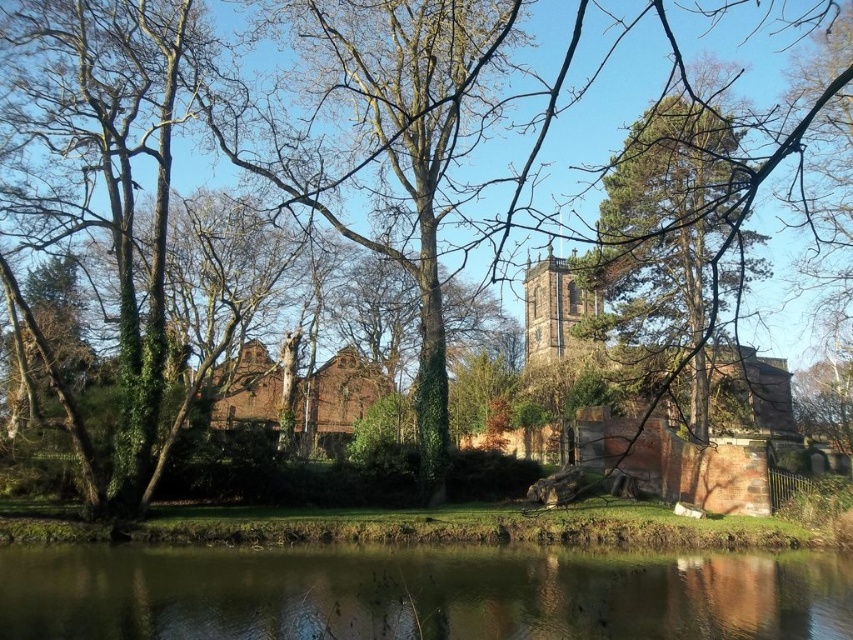
Question: Which object is farther from the camera taking this photo?

Choices:
 (A) green leafy tree at center
 (B) green reflective water at bottom
 (C) brown brick church at center

Answer: (C)

Question: Which point is closer to the camera?

Choices:
 (A) (653, 273)
 (B) (94, 552)

Answer: (B)

Question: Which object appears farthest from the camera in this image?

Choices:
 (A) green reflective water at bottom
 (B) green leafy tree at center
 (C) brown brick church at center

Answer: (C)

Question: Is green reflective water at bottom closer to the viewer compared to green leafy tree at center?

Choices:
 (A) yes
 (B) no

Answer: (B)

Question: Can you confirm if green leafy tree at center is thinner than brown brick church at center?

Choices:
 (A) yes
 (B) no

Answer: (B)

Question: Considering the relative positions of green reflective water at bottom and brown brick church at center in the image provided, where is green reflective water at bottom located with respect to brown brick church at center?

Choices:
 (A) left
 (B) right

Answer: (B)